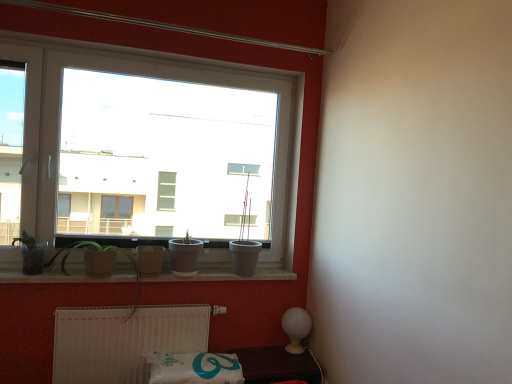
Question: Does white glossy lamp at lower right appear on the right side of white plastic window at upper left?

Choices:
 (A) no
 (B) yes

Answer: (B)

Question: From a real-world perspective, is white glossy lamp at lower right on white plastic window at upper left?

Choices:
 (A) yes
 (B) no

Answer: (B)

Question: Considering the relative sizes of white glossy lamp at lower right and white plastic window at upper left in the image provided, is white glossy lamp at lower right smaller than white plastic window at upper left?

Choices:
 (A) no
 (B) yes

Answer: (B)

Question: Does white glossy lamp at lower right have a greater width compared to white plastic window at upper left?

Choices:
 (A) yes
 (B) no

Answer: (A)

Question: From a real-world perspective, is white glossy lamp at lower right positioned under white plastic window at upper left based on gravity?

Choices:
 (A) yes
 (B) no

Answer: (A)

Question: Is matte glass pot at left, the first plant positioned from the left, in front of or behind matte gray pot at center in the image?

Choices:
 (A) behind
 (B) front

Answer: (B)

Question: From a real-world perspective, relative to matte gray pot at center, is matte glass pot at left, which appears as the second plant when viewed from the right, vertically above or below?

Choices:
 (A) below
 (B) above

Answer: (A)

Question: Which is correct: matte glass pot at left, which appears as the second plant when viewed from the right, is inside matte gray pot at center, or outside of it?

Choices:
 (A) inside
 (B) outside

Answer: (B)

Question: Does point (34, 271) appear closer or farther from the camera than point (201, 240)?

Choices:
 (A) closer
 (B) farther

Answer: (A)

Question: In the image, is white plastic radiator at lower center positioned in front of or behind white glossy lamp at lower right?

Choices:
 (A) behind
 (B) front

Answer: (B)

Question: From the image's perspective, is white plastic radiator at lower center located above or below white glossy lamp at lower right?

Choices:
 (A) below
 (B) above

Answer: (B)

Question: Considering the positions of point [x=126, y=349] and point [x=270, y=347], is point [x=126, y=349] closer or farther from the camera than point [x=270, y=347]?

Choices:
 (A) farther
 (B) closer

Answer: (B)

Question: Based on their sizes in the image, would you say white plastic radiator at lower center is bigger or smaller than white glossy lamp at lower right?

Choices:
 (A) small
 (B) big

Answer: (B)

Question: From a real-world perspective, relative to matte gray pot at center, is white concrete window sill at lower center vertically above or below?

Choices:
 (A) above
 (B) below

Answer: (B)

Question: Is white concrete window sill at lower center situated inside matte gray pot at center or outside?

Choices:
 (A) outside
 (B) inside

Answer: (A)